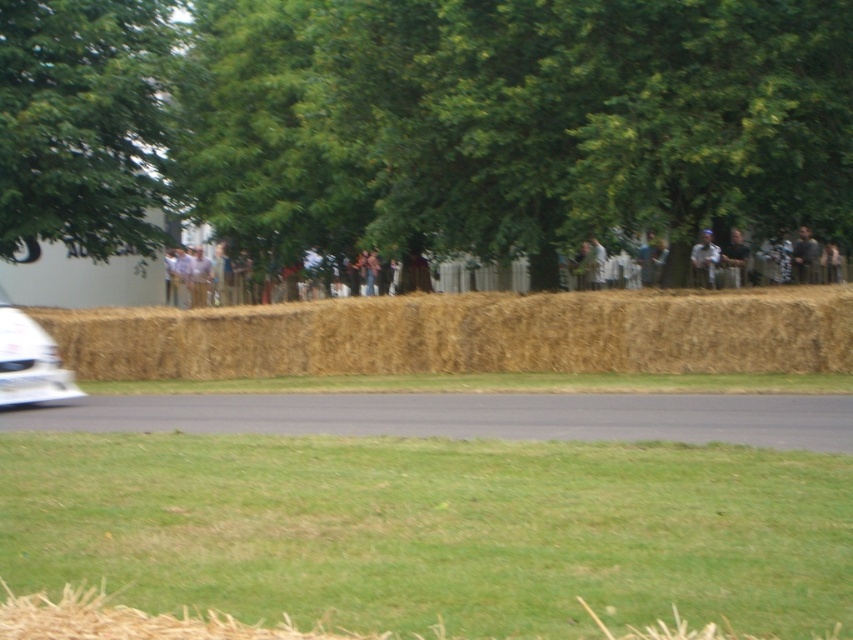
Question: Considering the real-world distances, which object is farthest from the blue denim jacket at upper center?

Choices:
 (A) dark brown leather jacket at upper right
 (B) black asphalt road at center
 (C) white glossy car at left

Answer: (C)

Question: Which object is the farthest from the dark brown leather jacket at upper right?

Choices:
 (A) blue denim jacket at upper center
 (B) black asphalt road at center
 (C) white glossy car at left
 (D) brown straw bales at center

Answer: (B)

Question: Does brown straw bales at center appear over black asphalt road at center?

Choices:
 (A) yes
 (B) no

Answer: (A)

Question: Which object appears closest to the camera in this image?

Choices:
 (A) dark brown leather jacket at upper right
 (B) white glossy car at left
 (C) blue denim jacket at upper center

Answer: (B)

Question: Is brown straw bales at center further to camera compared to blue denim jacket at upper center?

Choices:
 (A) yes
 (B) no

Answer: (B)

Question: Does brown straw bales at center have a larger size compared to white glossy car at left?

Choices:
 (A) yes
 (B) no

Answer: (A)